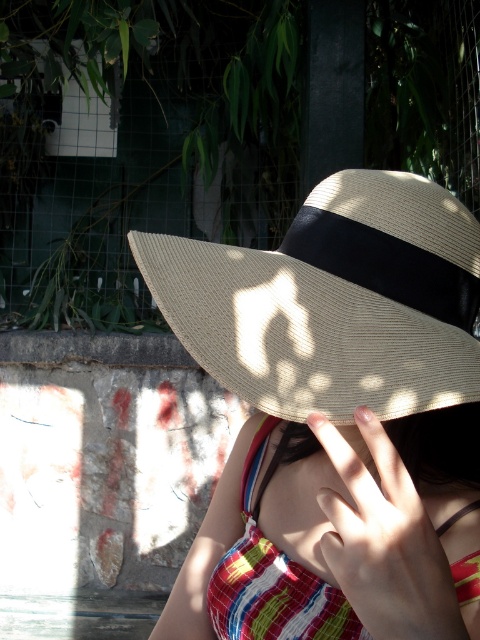
Does natural straw hat at center have a smaller size compared to striped fabric bikini top at center?

Indeed, natural straw hat at center has a smaller size compared to striped fabric bikini top at center.

Is natural straw hat at center below striped fabric bikini top at center?

No.

Who is more distant from viewer, (370, 336) or (285, 627)?

The point (285, 627) is more distant.

Locate an element on the screen. The image size is (480, 640). natural straw hat at center is located at coordinates (334, 301).